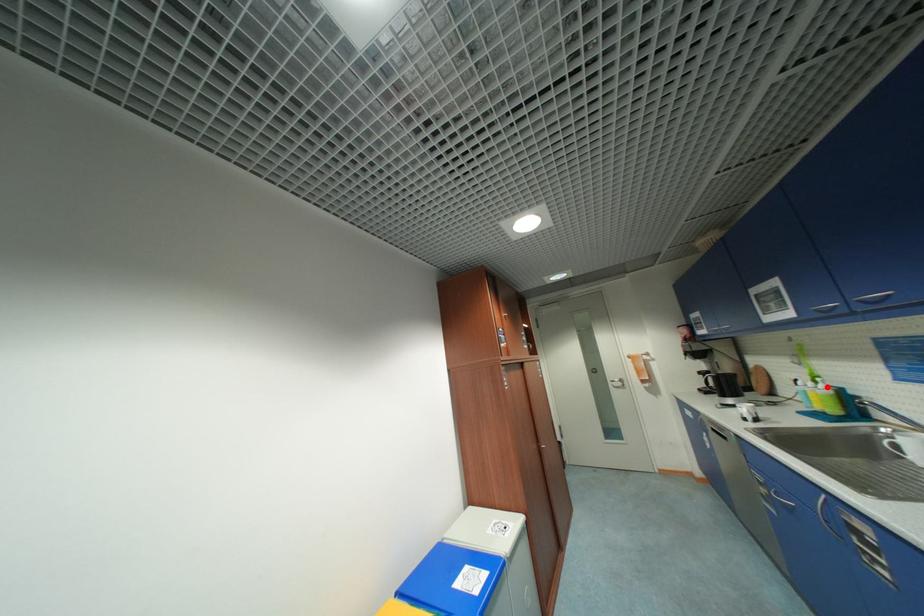
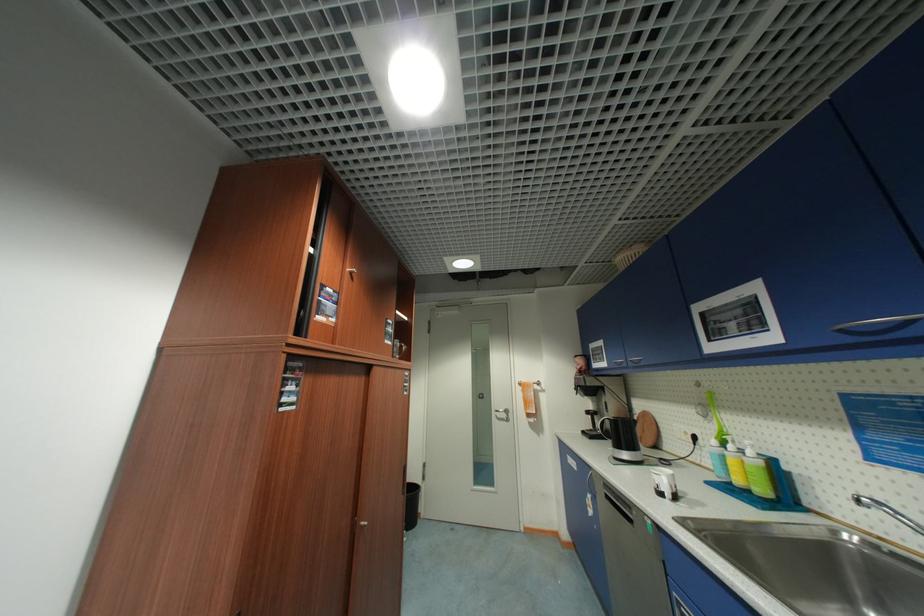
Locate, in the second image, the point that corresponds to the highlighted location in the first image.

(756, 454)